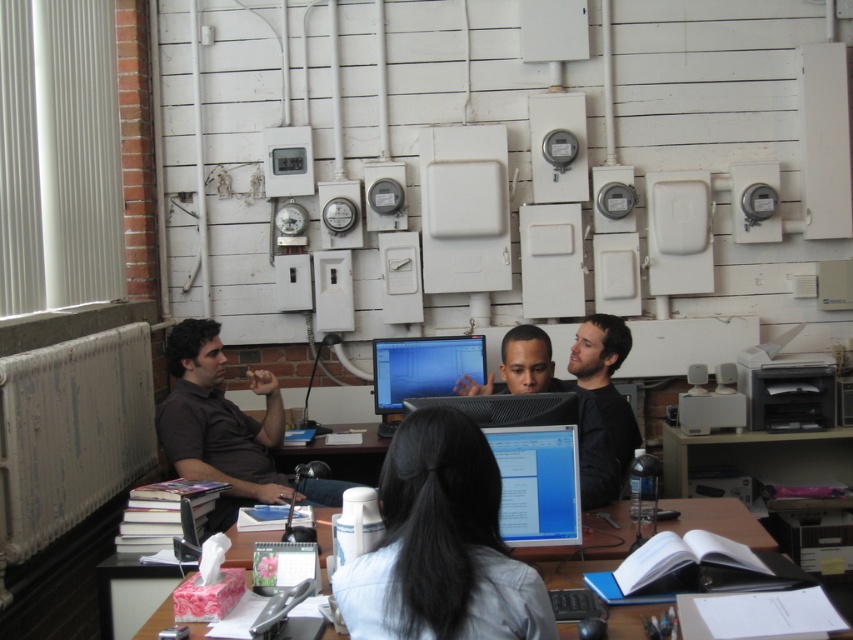
Which is in front, point (438, 609) or point (509, 410)?

Point (438, 609) is in front.

Locate an element on the screen. light blue shirt at center is located at coordinates (440, 545).

Image resolution: width=853 pixels, height=640 pixels. What do you see at coordinates (440, 545) in the screenshot? I see `light blue shirt at center` at bounding box center [440, 545].

The width and height of the screenshot is (853, 640). Identify the location of light blue shirt at center. (440, 545).

How distant is wooden desk at center from matte black monitor at center?

A distance of 1.39 meters exists between wooden desk at center and matte black monitor at center.

Is point (578, 572) closer to camera compared to point (392, 426)?

Yes, it is.

Where is `wooden desk at center`? The image size is (853, 640). wooden desk at center is located at coordinates (582, 550).

Is matte brown shirt at left taller than matte black monitor at center?

Correct, matte brown shirt at left is much taller as matte black monitor at center.

Between matte brown shirt at left and matte black monitor at center, which one is positioned lower?

matte brown shirt at left is lower down.

The height and width of the screenshot is (640, 853). Identify the location of matte brown shirt at left. (219, 422).